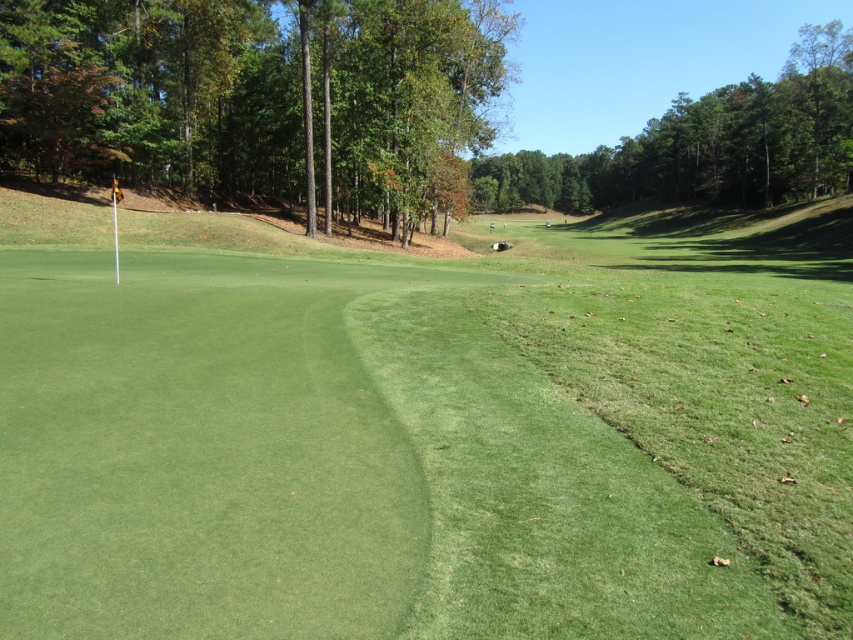
Between green smooth turf at center and green leafy tree at upper center, which one has less height?

green smooth turf at center

Is green smooth turf at center shorter than green leafy tree at upper center?

Correct, green smooth turf at center is not as tall as green leafy tree at upper center.

I want to click on green smooth turf at center, so click(x=432, y=440).

Who is higher up, green smooth turf at center or green leafy tree at upper right?

green leafy tree at upper right

The height and width of the screenshot is (640, 853). Describe the element at coordinates (432, 440) in the screenshot. I see `green smooth turf at center` at that location.

Describe the element at coordinates (432, 440) in the screenshot. I see `green smooth turf at center` at that location.

Locate an element on the screen. The height and width of the screenshot is (640, 853). green smooth turf at center is located at coordinates (432, 440).

Is green leafy tree at upper center taller than green leafy tree at upper right?

No.

Can you confirm if green leafy tree at upper center is smaller than green leafy tree at upper right?

Yes.

Find the location of a particular element. Image resolution: width=853 pixels, height=640 pixels. green leafy tree at upper center is located at coordinates (256, 96).